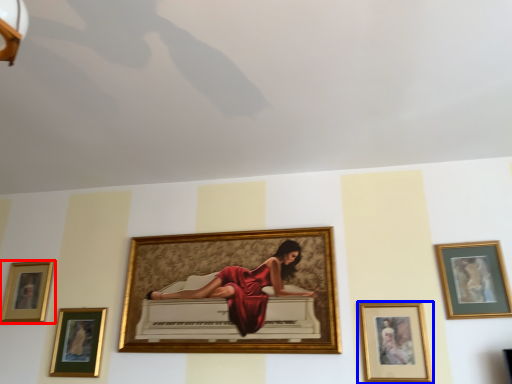
Question: Which object appears closest to the camera in this image, picture frame (highlighted by a red box) or picture frame (highlighted by a blue box)?

Choices:
 (A) picture frame
 (B) picture frame

Answer: (B)